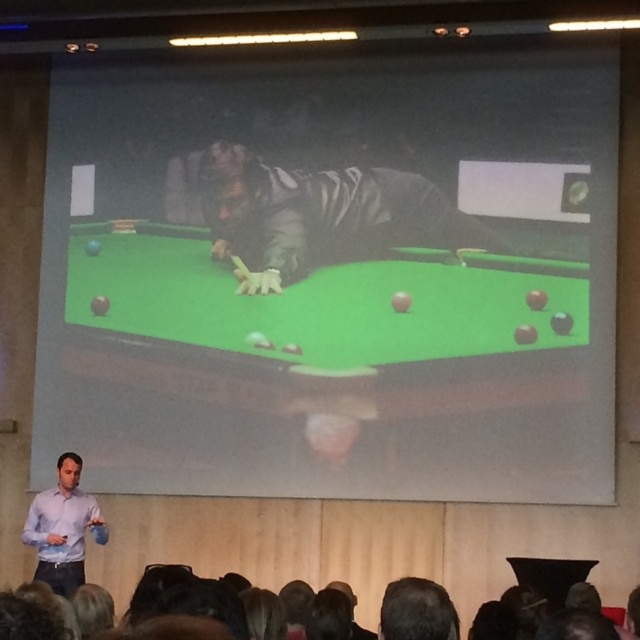
Looking at the presentation screen, which object is larger between the green felt billiard table at center and the dark matte jacket at center?

The green felt billiard table at center is bigger than the dark matte jacket at center.

Based on the photo, you are a photographer positioned at the front of the stage. You want to take a photo of the green felt billiard table at center as it appears on the projection screen. Where should you aim your camera to capture it perfectly?

You should aim your camera at point (321,300) to capture the green felt billiard table at center perfectly as it is located there on the screen.